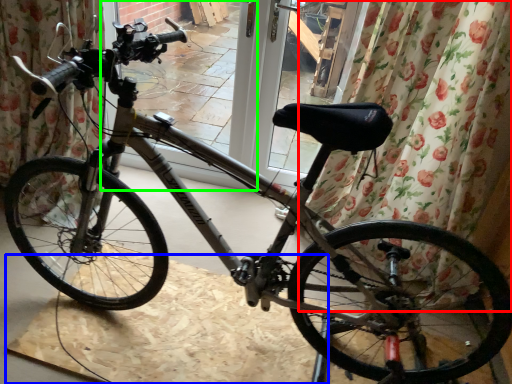
Question: Which object is the farthest from curtain (highlighted by a red box)? Choose among these: cardboard (highlighted by a blue box) or screen door (highlighted by a green box).

Choices:
 (A) cardboard
 (B) screen door

Answer: (B)